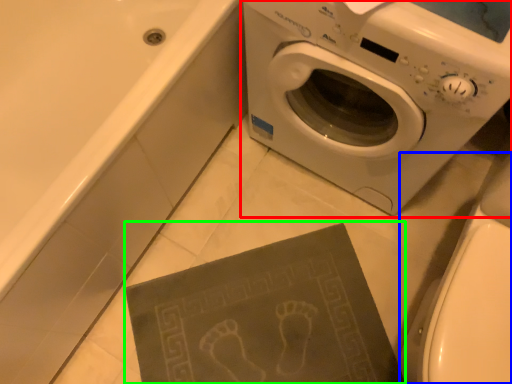
Question: Which object is the farthest from washing machine (highlighted by a red box)? Choose among these: toilet bowl (highlighted by a blue box) or paperback book (highlighted by a green box).

Choices:
 (A) toilet bowl
 (B) paperback book

Answer: (B)